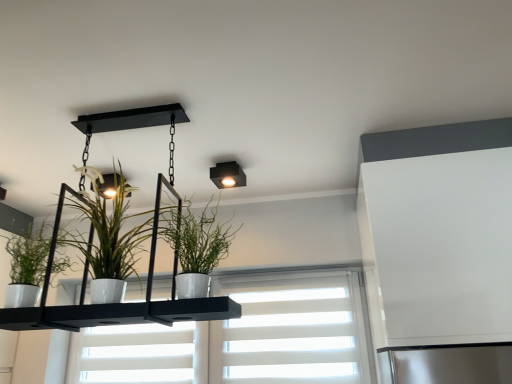
Question: Is white glossy pot at center, which appears as the second houseplant when viewed from the right, positioned with its back to white glossy pot at center, which is the third houseplant in left-to-right order?

Choices:
 (A) yes
 (B) no

Answer: (B)

Question: From the image's perspective, is white glossy pot at center, the 2th houseplant from the left, below white glossy pot at center, which is the third houseplant in left-to-right order?

Choices:
 (A) no
 (B) yes

Answer: (A)

Question: Is white glossy pot at center, the 2th houseplant from the left, smaller than white glossy pot at center, marked as the first houseplant in a right-to-left arrangement?

Choices:
 (A) no
 (B) yes

Answer: (A)

Question: From the image's perspective, is white glossy pot at center, the 2th houseplant from the left, above white glossy pot at center, marked as the first houseplant in a right-to-left arrangement?

Choices:
 (A) no
 (B) yes

Answer: (B)

Question: Could you tell me if white glossy pot at center, which appears as the second houseplant when viewed from the right, is turned towards white glossy pot at center, which is the third houseplant in left-to-right order?

Choices:
 (A) yes
 (B) no

Answer: (B)

Question: Considering the relative sizes of white glossy pot at center, the 2th houseplant from the left, and white glossy pot at center, which is the third houseplant in left-to-right order, in the image provided, is white glossy pot at center, the 2th houseplant from the left, taller than white glossy pot at center, which is the third houseplant in left-to-right order,?

Choices:
 (A) yes
 (B) no

Answer: (A)

Question: Is green matte plant at left, placed as the third houseplant when sorted from right to left, facing away from white glossy pot at center, marked as the first houseplant in a right-to-left arrangement?

Choices:
 (A) no
 (B) yes

Answer: (A)

Question: Is green matte plant at left, placed as the third houseplant when sorted from right to left, further to camera compared to white glossy pot at center, marked as the first houseplant in a right-to-left arrangement?

Choices:
 (A) no
 (B) yes

Answer: (B)

Question: Does green matte plant at left, placed as the third houseplant when sorted from right to left, have a lesser width compared to white glossy pot at center, which is the third houseplant in left-to-right order?

Choices:
 (A) no
 (B) yes

Answer: (B)

Question: Can you confirm if green matte plant at left, the first houseplant from the left, is positioned to the left of white glossy pot at center, which is the third houseplant in left-to-right order?

Choices:
 (A) no
 (B) yes

Answer: (B)

Question: Can you confirm if green matte plant at left, the first houseplant from the left, is shorter than white glossy pot at center, marked as the first houseplant in a right-to-left arrangement?

Choices:
 (A) no
 (B) yes

Answer: (B)

Question: From the image's perspective, is green matte plant at left, the first houseplant from the left, on white glossy pot at center, which is the third houseplant in left-to-right order?

Choices:
 (A) yes
 (B) no

Answer: (B)

Question: Is white glossy pot at center, which appears as the second houseplant when viewed from the right, to the left of matte black square light fixture at upper center from the viewer's perspective?

Choices:
 (A) yes
 (B) no

Answer: (A)